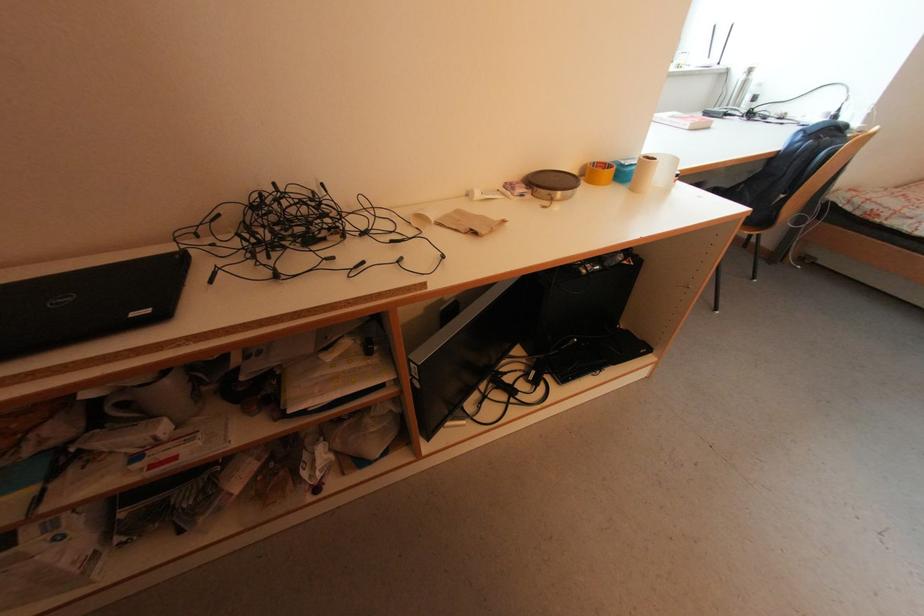
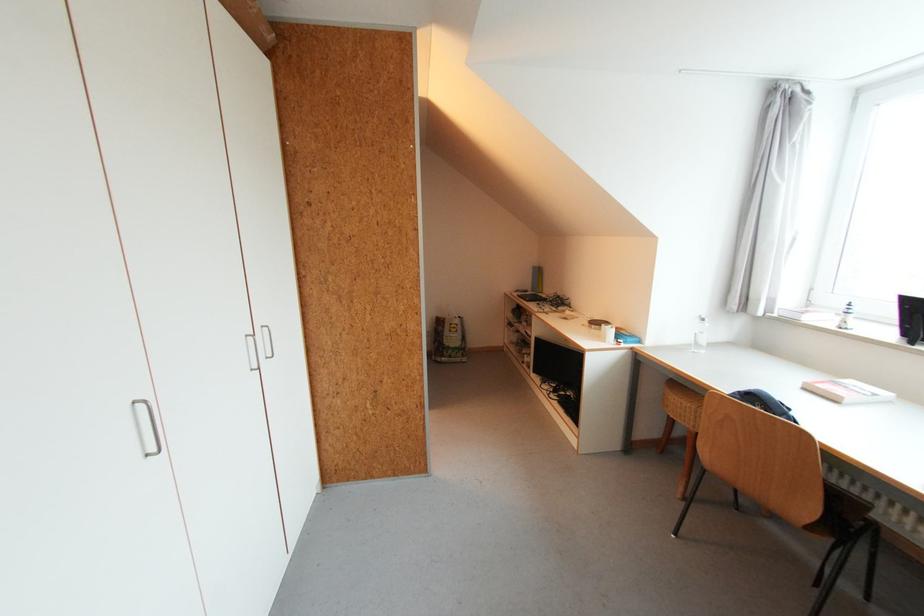
Locate, in the second image, the point that corresponds to the point at 714,129 in the first image.

(841, 403)